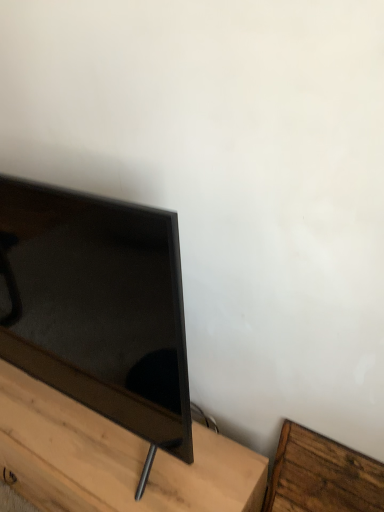
The width and height of the screenshot is (384, 512). What are the coordinates of `vacant region under matte black tv at left (from a real-world perspective)` in the screenshot? It's located at (66, 415).